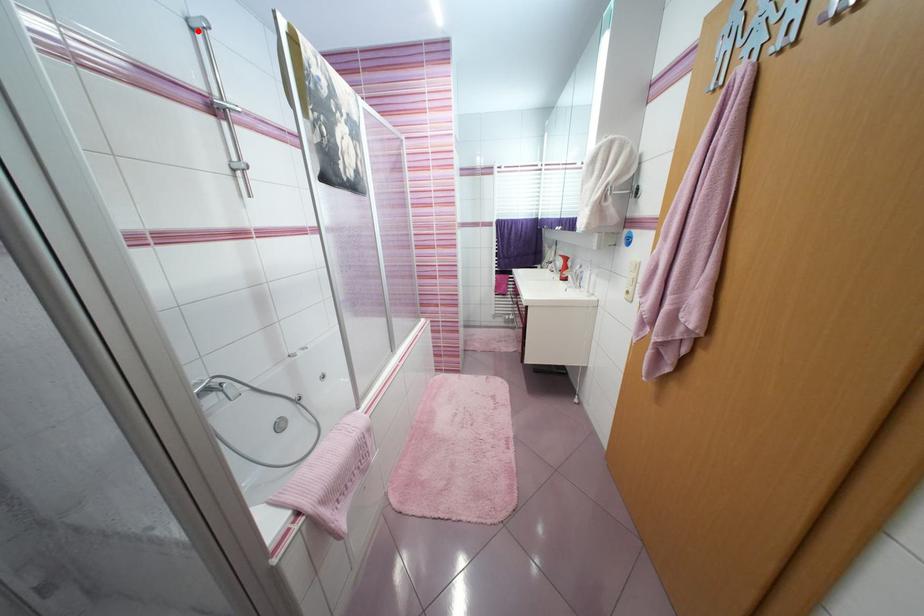
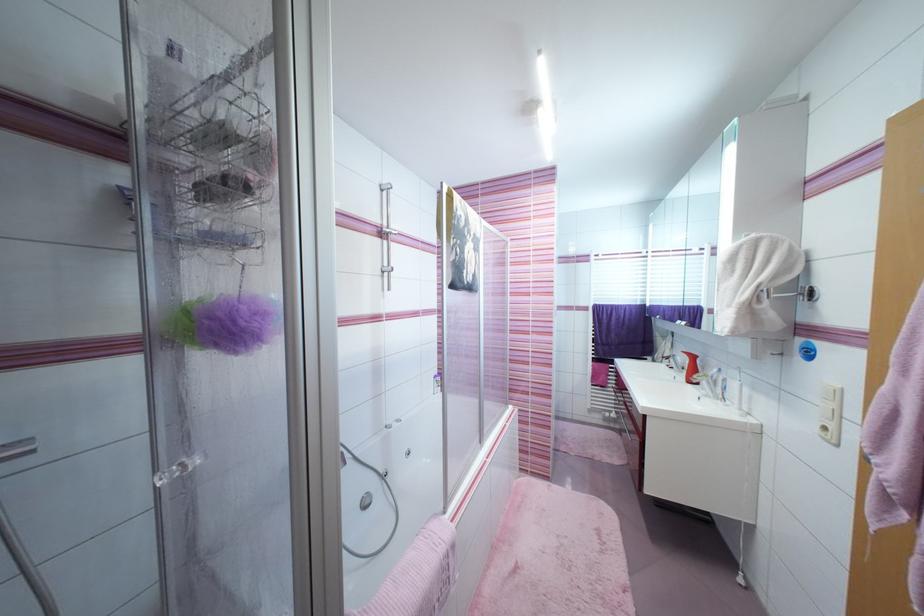
Locate, in the second image, the point that corresponds to the highlighted location in the first image.

(387, 192)